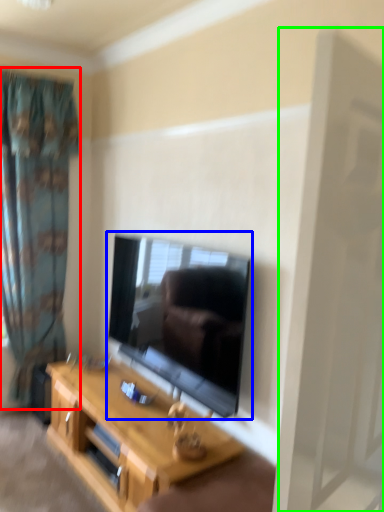
Question: Which object is the closest to the curtain (highlighted by a red box)? Choose among these: television (highlighted by a blue box) or screen door (highlighted by a green box).

Choices:
 (A) television
 (B) screen door

Answer: (A)